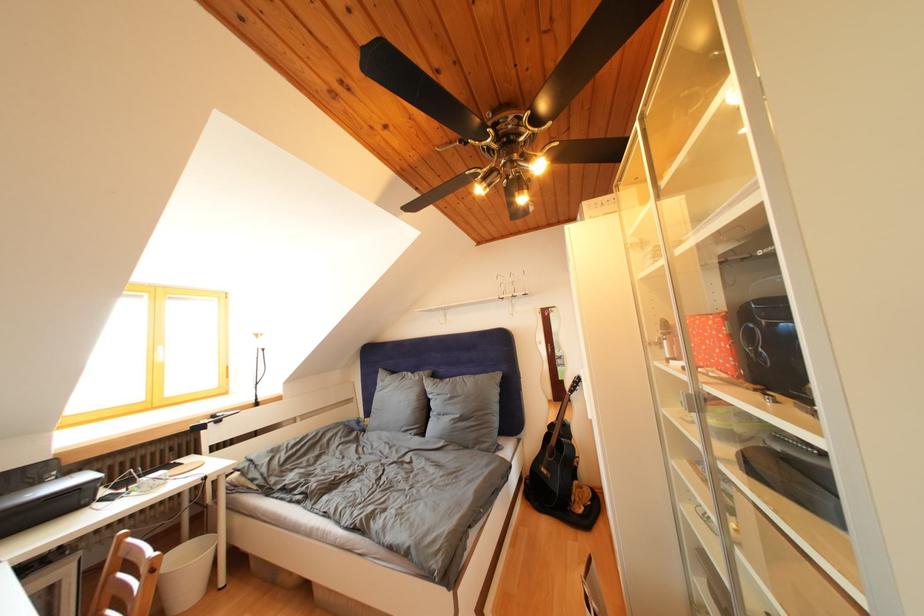
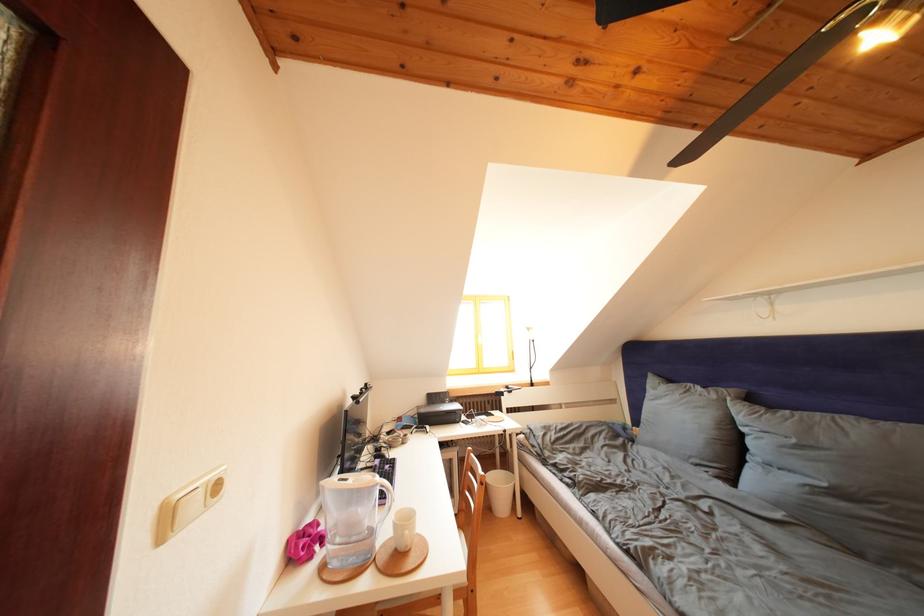
In the second image, find the point that corresponds to (457,400) in the first image.

(801, 446)